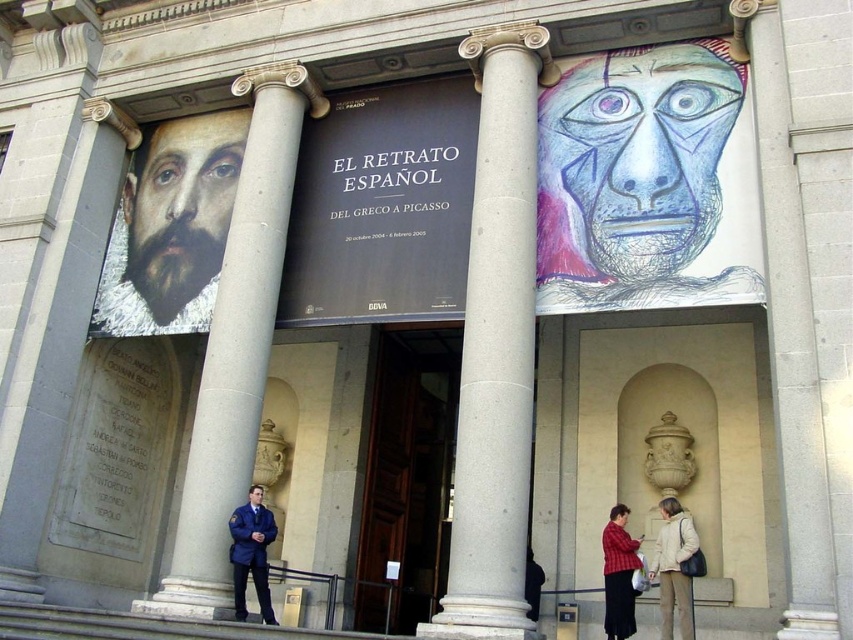
Does point (227, 378) lie in front of point (686, 634)?

No, it is behind (686, 634).

Between smooth stone column at center and white cotton coat at lower right, which one appears on the right side from the viewer's perspective?

white cotton coat at lower right is more to the right.

I want to click on smooth stone column at center, so click(236, 340).

Does matte black portrait at left appear under blue uniform at center?

Incorrect, matte black portrait at left is not positioned below blue uniform at center.

Is matte black portrait at left positioned at the back of blue uniform at center?

Yes, matte black portrait at left is behind blue uniform at center.

Is point (225, 145) positioned behind point (242, 534)?

Yes, point (225, 145) is farther from viewer.

Find the location of a particular element. This screenshot has height=640, width=853. matte black portrait at left is located at coordinates (171, 227).

This screenshot has height=640, width=853. Find the location of `black paper at center`. black paper at center is located at coordinates (381, 205).

Does black paper at center appear under white cotton coat at lower right?

Actually, black paper at center is above white cotton coat at lower right.

At what (x,y) coordinates should I click in order to perform the action: click on black paper at center. Please return your answer as a coordinate pair (x, y). The width and height of the screenshot is (853, 640). Looking at the image, I should click on (381, 205).

Identify the location of black paper at center. (381, 205).